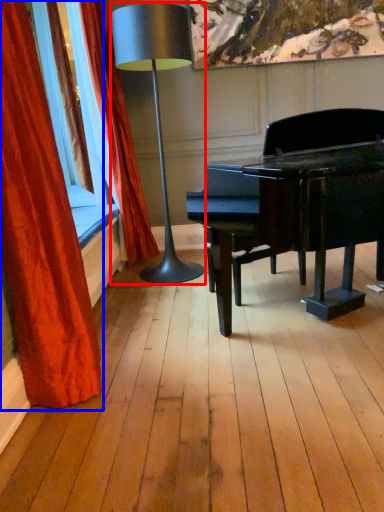
Question: Which of the following is the closest to the observer, lamp (highlighted by a red box) or curtain (highlighted by a blue box)?

Choices:
 (A) lamp
 (B) curtain

Answer: (B)